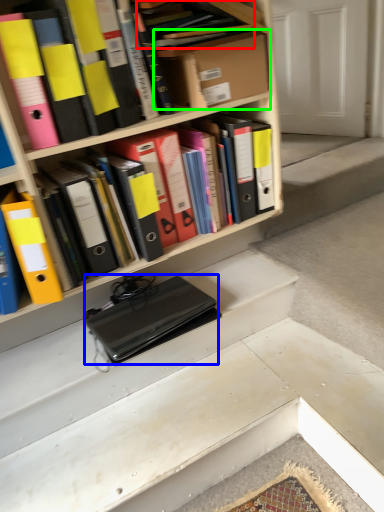
Question: Based on their relative distances, which object is nearer to book (highlighted by a red box)? Choose from laptop (highlighted by a blue box) and cardboard box (highlighted by a green box).

Choices:
 (A) laptop
 (B) cardboard box

Answer: (B)